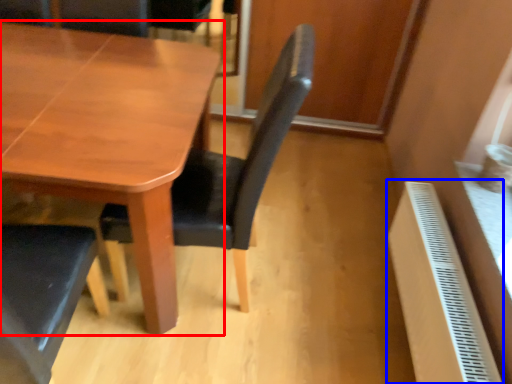
Question: Which object appears farthest to the camera in this image, table (highlighted by a red box) or radiator (highlighted by a blue box)?

Choices:
 (A) table
 (B) radiator

Answer: (B)